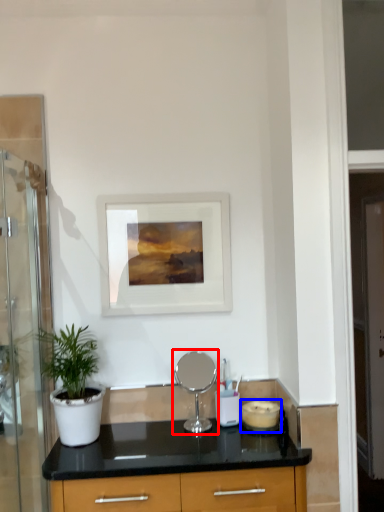
Question: Which of the following is the farthest to the observer, appliance (highlighted by a red box) or appliance (highlighted by a blue box)?

Choices:
 (A) appliance
 (B) appliance

Answer: (B)